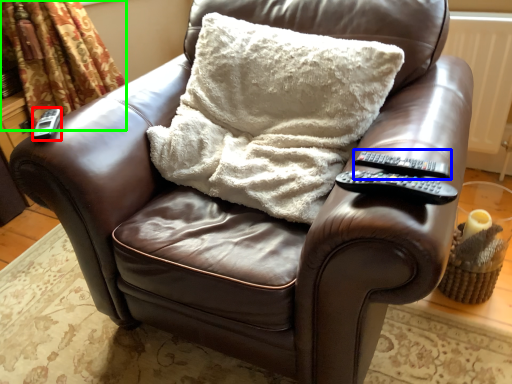
Question: Based on their relative distances, which object is farther from remote (highlighted by a red box)? Choose from remote (highlighted by a blue box) and curtain (highlighted by a green box).

Choices:
 (A) remote
 (B) curtain

Answer: (B)